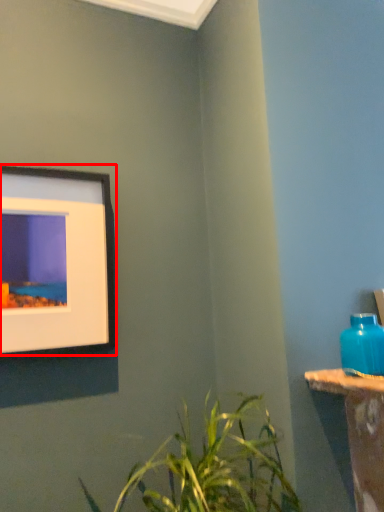
Question: Observing the image, what is the correct spatial positioning of picture frame (annotated by the red box) in reference to bottle?

Choices:
 (A) left
 (B) right

Answer: (A)